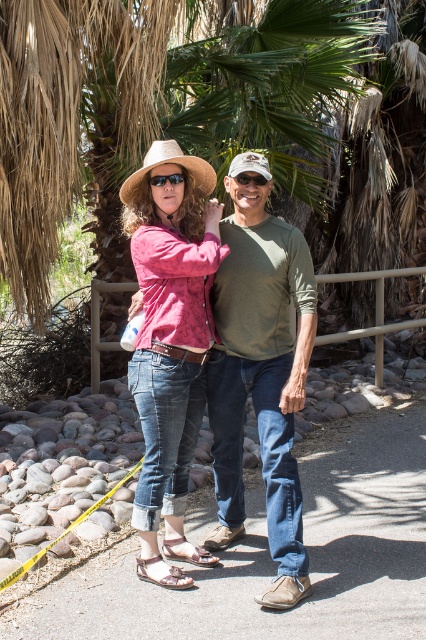
You are a photographer trying to capture a clear photo of the white matte cowboy hat at center without the brown textured palm tree at center blocking it. Based on their positions, is this possible?

The white matte cowboy hat at center is behind the brown textured palm tree at center, so it would be blocked from view. To capture a clear photo of the white matte cowboy hat at center without the palm tree blocking it, you would need to reposition yourself or the objects to change their relative positions.

Based on the photo, you are a photographer setting up a tripod to capture the scene. The tripod has a height adjustment range of 1.2 meters to 1.8 meters. You want to ensure both the leather textured sandal at lower left and the white matte cowboy hat at center are in frame. Considering their sizes, will the tripod need to be adjusted to its maximum height to include both objects?

The leather textured sandal at lower left is smaller than the white matte cowboy hat at center. Since the sandal is smaller, it might be closer to the ground, requiring the tripod to be lowered. However, the cowboy hat is larger and possibly higher up, so the tripod may need to be adjusted to its maximum height of 1.8 meters to ensure both objects are in frame.

You are standing at the point labeled as point [143,577] and want to walk towards the direction of the person on the left. Is the point labeled as point [63,120] located behind you or in front of you?

Point [63,120] is behind point [143,577], so it is located behind you.